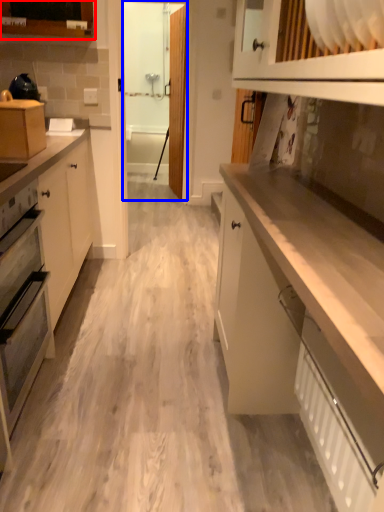
Question: Which of the following is the farthest to the observer, cabinetry (highlighted by a red box) or glass door (highlighted by a blue box)?

Choices:
 (A) cabinetry
 (B) glass door

Answer: (B)